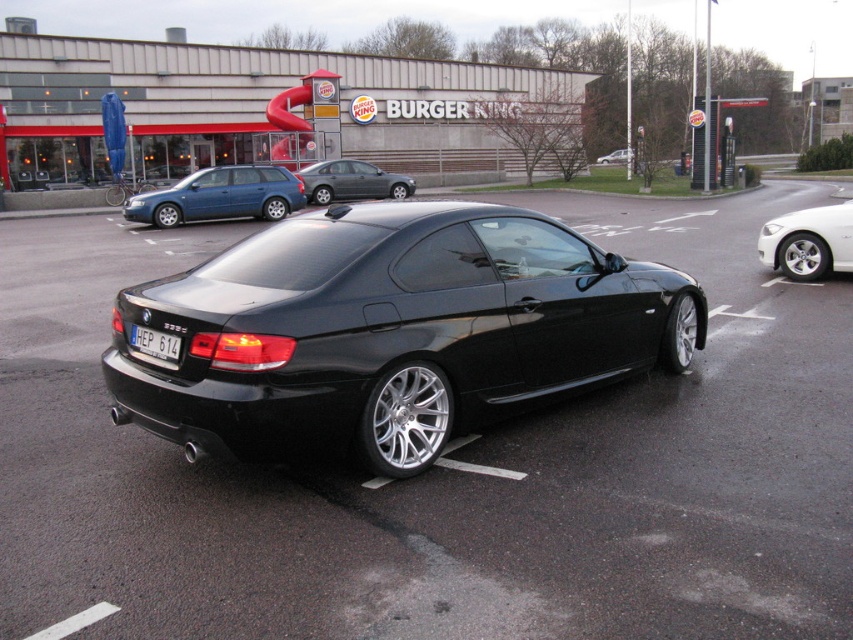
Question: Can you confirm if black metallic sports car at center is smaller than matte blue station wagon at left?

Choices:
 (A) no
 (B) yes

Answer: (B)

Question: Does metallic gray sedan at center appear under matte black car at center?

Choices:
 (A) yes
 (B) no

Answer: (A)

Question: Does matte blue station wagon at left have a lesser width compared to white metallic sedan at right?

Choices:
 (A) no
 (B) yes

Answer: (A)

Question: Among these objects, which one is farthest from the camera?

Choices:
 (A) white metallic sedan at right
 (B) black metallic sports car at center
 (C) matte black car at center
 (D) black metallic car at center

Answer: (C)

Question: Which object is closer to the camera taking this photo?

Choices:
 (A) black metallic car at center
 (B) white plastic license plate at center
 (C) white metallic sedan at right
 (D) metallic gray sedan at center

Answer: (A)

Question: Which point is farther to the camera?

Choices:
 (A) (212, 211)
 (B) (393, 196)

Answer: (B)